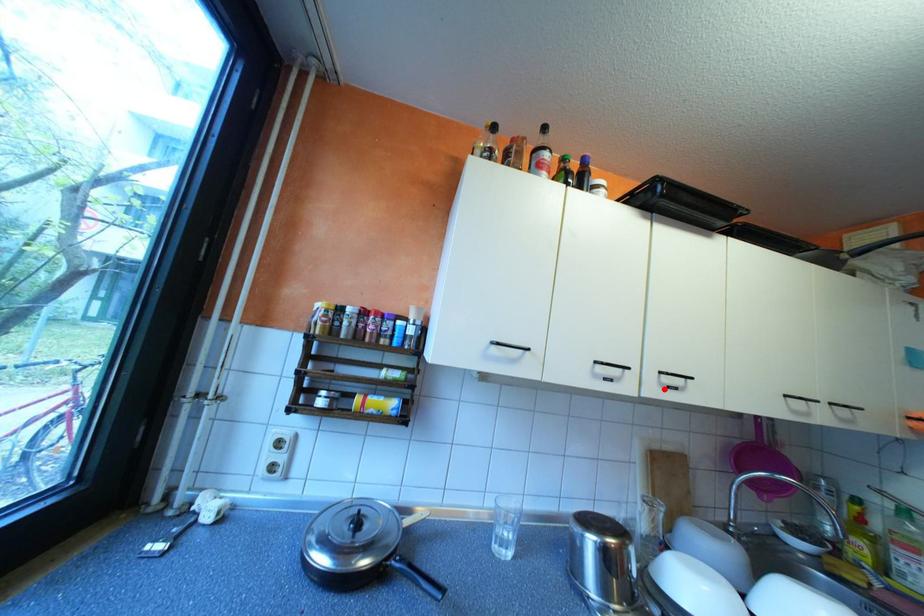
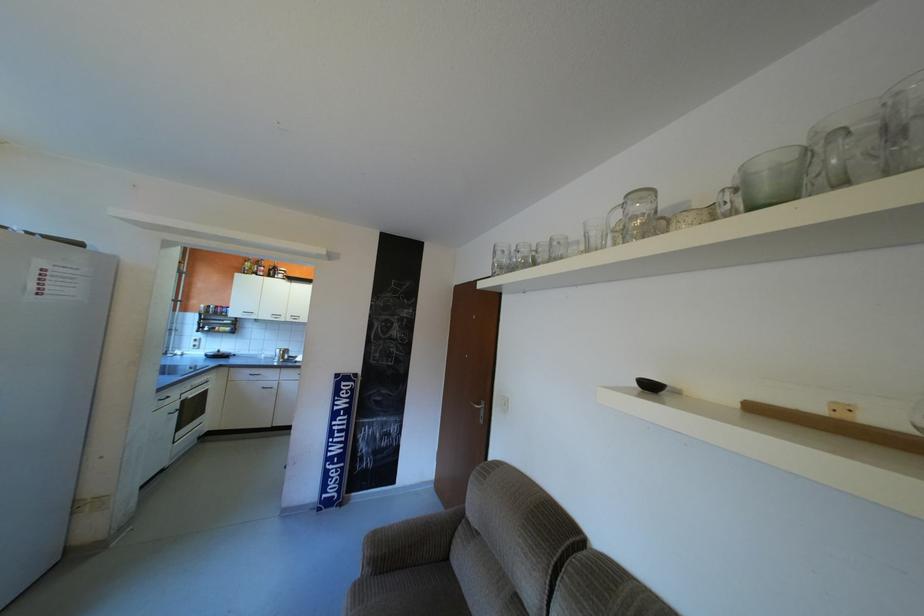
Where in the second image is the point corresponding to the highlighted location from the first image?

(300, 318)